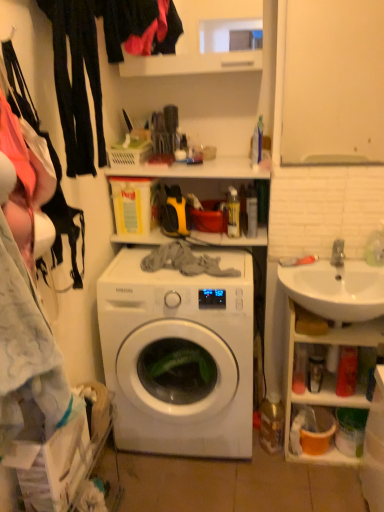
The height and width of the screenshot is (512, 384). Find the location of `free spot in front of white glossy sink at lower right`. free spot in front of white glossy sink at lower right is located at coordinates (321, 487).